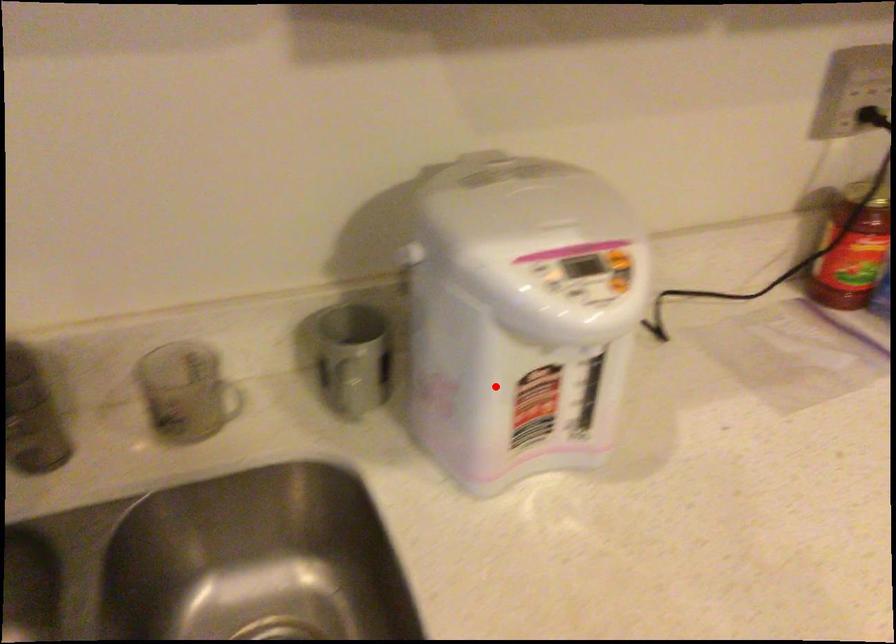
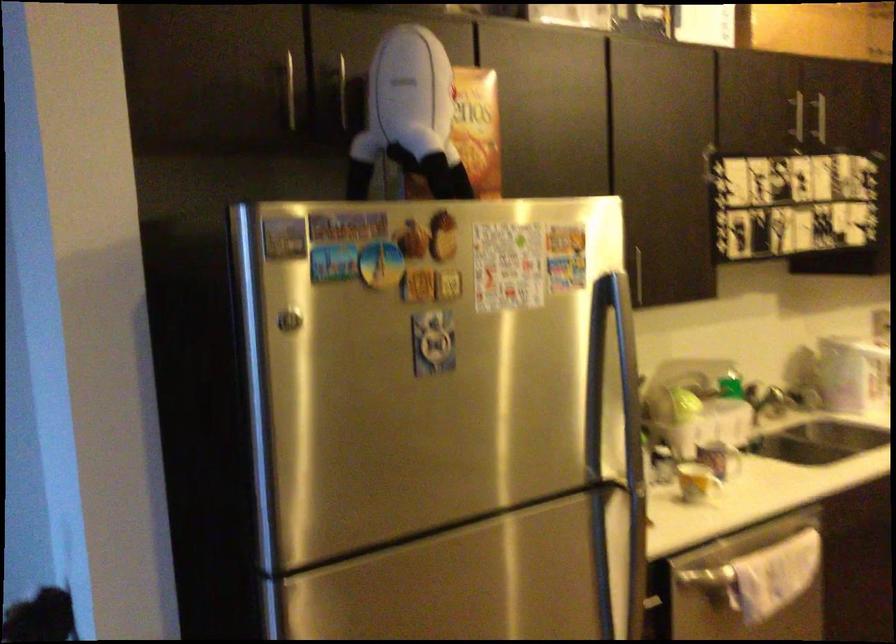
Question: I am providing you with two images of the same scene from different viewpoints. Image1 has a red point marked. In image2, the corresponding 3D location appears at what relative position? Reply with the corresponding letter.

Choices:
 (A) Closer
 (B) Farther

Answer: (B)